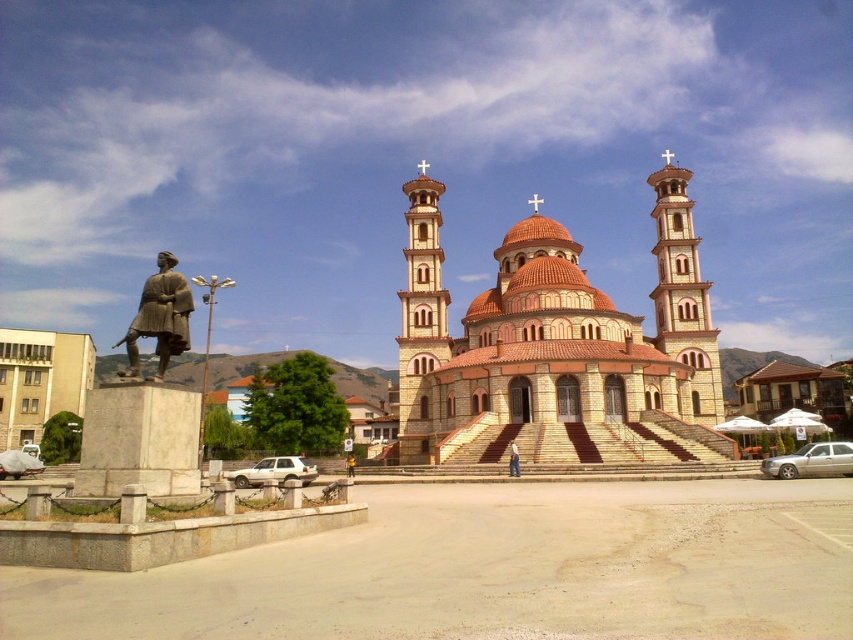
Does light brown stone tower at center right appear over beige stone tower at center?

Correct, light brown stone tower at center right is located above beige stone tower at center.

What do you see at coordinates (683, 298) in the screenshot? This screenshot has width=853, height=640. I see `light brown stone tower at center right` at bounding box center [683, 298].

Is point (672, 227) behind point (412, 332)?

That is True.

Locate an element on the screen. light brown stone tower at center right is located at coordinates (683, 298).

Is terracotta stone church at center smaller than bronze statue at left?

Correct, terracotta stone church at center occupies less space than bronze statue at left.

Image resolution: width=853 pixels, height=640 pixels. Describe the element at coordinates (555, 339) in the screenshot. I see `terracotta stone church at center` at that location.

Identify the location of terracotta stone church at center. This screenshot has width=853, height=640. (555, 339).

Is terracotta stone church at center to the left of light brown wooden statue at center from the viewer's perspective?

Incorrect, terracotta stone church at center is not on the left side of light brown wooden statue at center.

Is point (584, 282) positioned in front of point (511, 468)?

That is False.

Identify the location of terracotta stone church at center. The height and width of the screenshot is (640, 853). (555, 339).